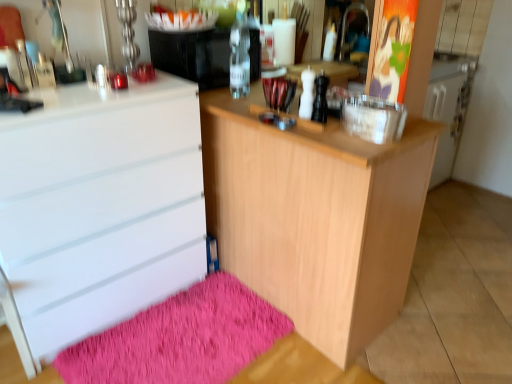
Question: Would you say white glossy chest of drawers at left is a long distance from light wood cabinet at center?

Choices:
 (A) yes
 (B) no

Answer: (B)

Question: Is white glossy chest of drawers at left facing away from light wood cabinet at center?

Choices:
 (A) no
 (B) yes

Answer: (A)

Question: Is white glossy chest of drawers at left smaller than light wood cabinet at center?

Choices:
 (A) no
 (B) yes

Answer: (B)

Question: Is white glossy chest of drawers at left next to light wood cabinet at center?

Choices:
 (A) no
 (B) yes

Answer: (A)

Question: Does white glossy chest of drawers at left lie in front of light wood cabinet at center?

Choices:
 (A) no
 (B) yes

Answer: (B)

Question: Considering the relative positions of white glossy chest of drawers at left and light wood cabinet at center in the image provided, is white glossy chest of drawers at left behind light wood cabinet at center?

Choices:
 (A) yes
 (B) no

Answer: (B)

Question: Is shaggy pink bath mat at lower left smaller than clear glass bottle at center?

Choices:
 (A) no
 (B) yes

Answer: (A)

Question: Can you confirm if shaggy pink bath mat at lower left is thinner than clear glass bottle at center?

Choices:
 (A) yes
 (B) no

Answer: (B)

Question: Considering the relative positions of shaggy pink bath mat at lower left and clear glass bottle at center in the image provided, is shaggy pink bath mat at lower left behind clear glass bottle at center?

Choices:
 (A) no
 (B) yes

Answer: (A)

Question: From a real-world perspective, is shaggy pink bath mat at lower left below clear glass bottle at center?

Choices:
 (A) no
 (B) yes

Answer: (B)

Question: Does shaggy pink bath mat at lower left have a lesser height compared to clear glass bottle at center?

Choices:
 (A) yes
 (B) no

Answer: (A)

Question: Is shaggy pink bath mat at lower left looking in the opposite direction of clear glass bottle at center?

Choices:
 (A) yes
 (B) no

Answer: (B)

Question: From the image's perspective, is clear glass bottle at center on white glossy chest of drawers at left?

Choices:
 (A) yes
 (B) no

Answer: (A)